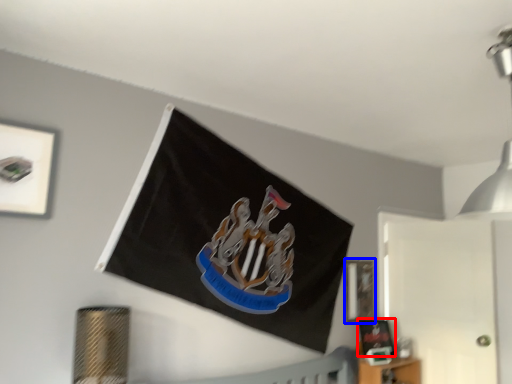
Question: Which point is closer to the camera, picture frame (highlighted by a red box) or picture frame (highlighted by a blue box)?

Choices:
 (A) picture frame
 (B) picture frame

Answer: (A)